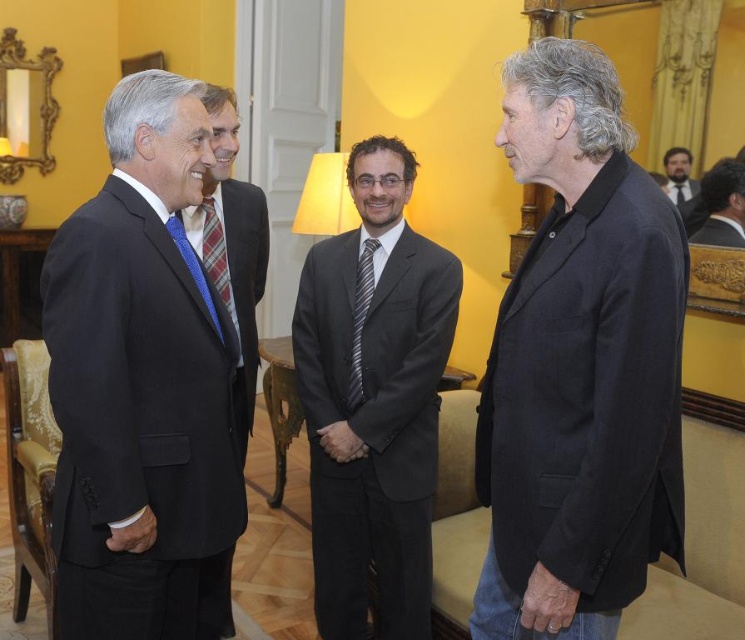
Between dark gray suit at center and black silk suit at upper right, which one has more height?

Standing taller between the two is dark gray suit at center.

Does dark gray suit at center have a lesser width compared to black silk suit at upper right?

No.

Describe the element at coordinates (372, 400) in the screenshot. I see `dark gray suit at center` at that location.

Where is `dark gray suit at center`? dark gray suit at center is located at coordinates (372, 400).

Does matte black suit at left come behind dark blue textured suit at center?

No, it is not.

Is point (92, 307) more distant than point (202, 257)?

No.

Between point (221, 625) and point (256, 193), which one is positioned behind?

The point (221, 625) is behind.

Where is `matte black suit at left`? matte black suit at left is located at coordinates (142, 387).

Which is below, black matte blazer at right or black silk tie at center?

Positioned lower is black matte blazer at right.

Is the position of black matte blazer at right more distant than that of black silk tie at center?

No, it is in front of black silk tie at center.

Between point (557, 45) and point (678, 195), which one is positioned behind?

The point (678, 195) is more distant.

At what (x,y) coordinates should I click in order to perform the action: click on black matte blazer at right. Please return your answer as a coordinate pair (x, y). The image size is (745, 640). Looking at the image, I should click on (580, 365).